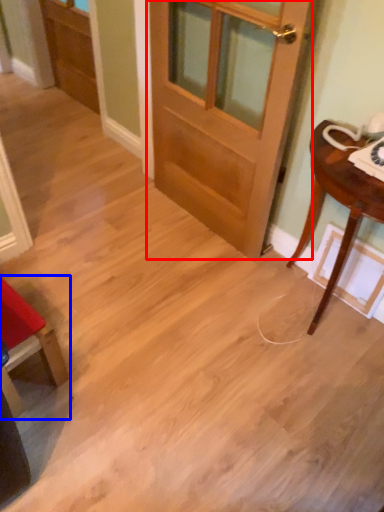
Question: Which point is further to the camera, door (highlighted by a red box) or chair (highlighted by a blue box)?

Choices:
 (A) door
 (B) chair

Answer: (B)